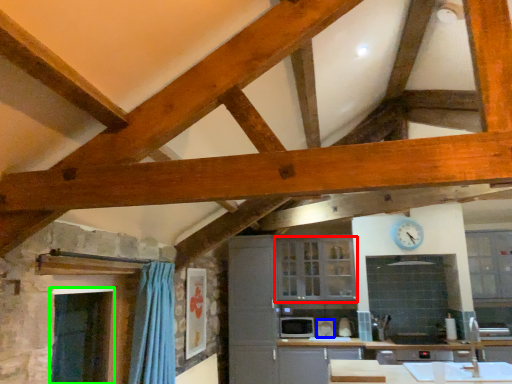
Question: Which is farther away from cabinetry (highlighted by a red box)? appliance (highlighted by a blue box) or window screen (highlighted by a green box)?

Choices:
 (A) appliance
 (B) window screen

Answer: (B)